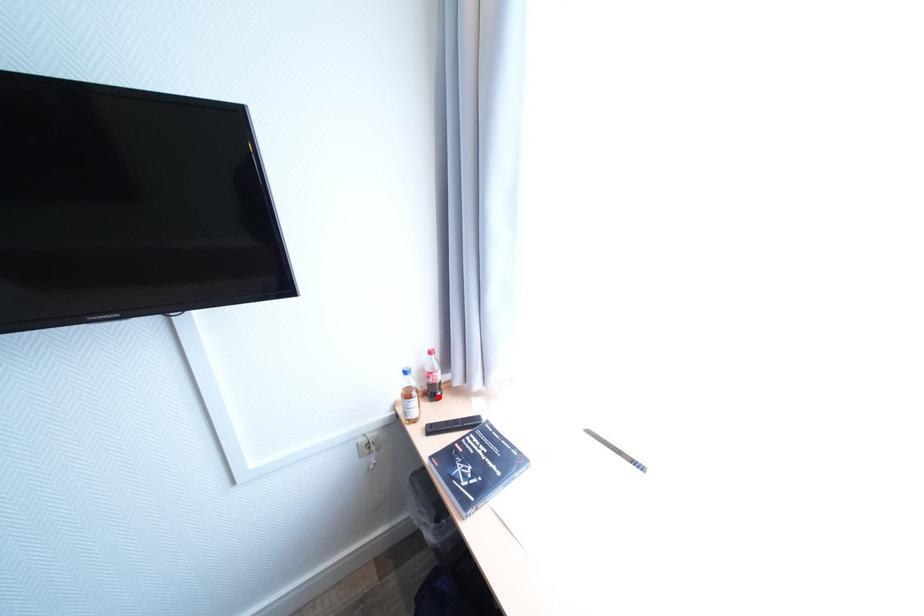
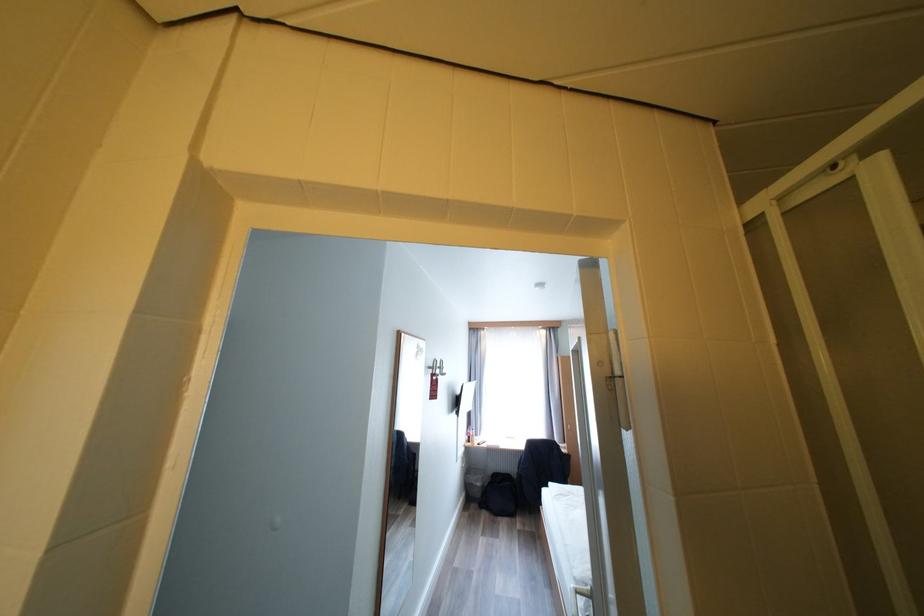
Question: I am providing you with two images of the same scene from different viewpoints. A red point is marked on the first image. At the location where the point appears in image 1, is it still visible in image 2?

Choices:
 (A) Yes
 (B) No

Answer: (B)